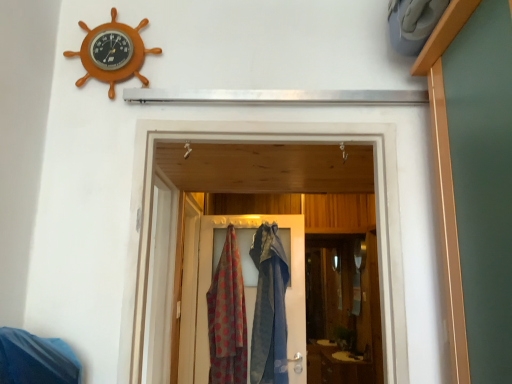
The height and width of the screenshot is (384, 512). I want to click on polka dot fabric scarf at center, so click(x=227, y=317).

Find the location of `orange wooden ship wheel at upper left`. orange wooden ship wheel at upper left is located at coordinates 112,53.

Is orange wooden ship wheel at upper left inside polka dot fabric scarf at center?

No.

From the image's perspective, is polka dot fabric scarf at center over orange wooden ship wheel at upper left?

No, from the image's perspective, polka dot fabric scarf at center is not on top of orange wooden ship wheel at upper left.

Which of these two, polka dot fabric scarf at center or orange wooden ship wheel at upper left, is bigger?

With larger size is polka dot fabric scarf at center.

Does textured fabric door at center have a smaller size compared to orange wooden ship wheel at upper left?

Actually, textured fabric door at center might be larger than orange wooden ship wheel at upper left.

What's the angular difference between textured fabric door at center and orange wooden ship wheel at upper left's facing directions?

8.61 degrees.

Looking at this image, from the image's perspective, is textured fabric door at center located above or below orange wooden ship wheel at upper left?

textured fabric door at center is below orange wooden ship wheel at upper left.

Based on the photo, can you confirm if textured fabric door at center is thinner than orange wooden ship wheel at upper left?

Incorrect, the width of textured fabric door at center is not less than that of orange wooden ship wheel at upper left.

In the scene shown: Can you confirm if polka dot fabric scarf at center is smaller than textured fabric door at center?

Yes, polka dot fabric scarf at center is smaller than textured fabric door at center.

At what (x,y) coordinates should I click in order to perform the action: click on clothing below the textured fabric door at center (from a real-world perspective). Please return your answer as a coordinate pair (x, y). This screenshot has height=384, width=512. Looking at the image, I should click on (227, 317).

Can we say polka dot fabric scarf at center lies outside textured fabric door at center?

Absolutely, polka dot fabric scarf at center is external to textured fabric door at center.

Can you tell me how much polka dot fabric scarf at center and textured fabric door at center differ in facing direction?

The angular difference between polka dot fabric scarf at center and textured fabric door at center is 3.8 degrees.

Between orange wooden ship wheel at upper left and polka dot fabric scarf at center, which one is positioned behind?

polka dot fabric scarf at center is further from the camera.

Consider the image. From the image's perspective, is orange wooden ship wheel at upper left positioned above or below polka dot fabric scarf at center?

Clearly, from the image's perspective, orange wooden ship wheel at upper left is above polka dot fabric scarf at center.

Is orange wooden ship wheel at upper left far away from polka dot fabric scarf at center?

Absolutely, orange wooden ship wheel at upper left is distant from polka dot fabric scarf at center.

Is orange wooden ship wheel at upper left completely or partially outside of polka dot fabric scarf at center?

Yes, orange wooden ship wheel at upper left is outside of polka dot fabric scarf at center.

Is textured fabric door at center further to the viewer compared to polka dot fabric scarf at center?

Yes, textured fabric door at center is further from the viewer.

From the image's perspective, is textured fabric door at center above polka dot fabric scarf at center?

Correct, textured fabric door at center appears higher than polka dot fabric scarf at center in the image.

Identify the location of door lying on the right of polka dot fabric scarf at center. (250, 279).

Is textured fabric door at center inside orange wooden ship wheel at upper left?

Actually, textured fabric door at center is outside orange wooden ship wheel at upper left.

From the image's perspective, which is above, orange wooden ship wheel at upper left or textured fabric door at center?

orange wooden ship wheel at upper left, from the image's perspective.

Can you tell me how much orange wooden ship wheel at upper left and textured fabric door at center differ in facing direction?

There is a 8.61-degree angle between the facing directions of orange wooden ship wheel at upper left and textured fabric door at center.

Does orange wooden ship wheel at upper left have a smaller size compared to textured fabric door at center?

Correct, orange wooden ship wheel at upper left occupies less space than textured fabric door at center.

The image size is (512, 384). Find the location of `clothing on the right side of orange wooden ship wheel at upper left`. clothing on the right side of orange wooden ship wheel at upper left is located at coordinates (227, 317).

In the image, there is a orange wooden ship wheel at upper left. Where is `door below it (from a real-world perspective)`? door below it (from a real-world perspective) is located at coordinates (250, 279).

Considering their positions, is textured fabric door at center positioned closer to orange wooden ship wheel at upper left than polka dot fabric scarf at center?

Among the two, polka dot fabric scarf at center is located nearer to orange wooden ship wheel at upper left.

Estimate the real-world distances between objects in this image. Which object is further from polka dot fabric scarf at center, orange wooden ship wheel at upper left or textured fabric door at center?

Based on the image, orange wooden ship wheel at upper left appears to be further to polka dot fabric scarf at center.

Based on their spatial positions, is polka dot fabric scarf at center or textured fabric door at center further from orange wooden ship wheel at upper left?

textured fabric door at center lies further to orange wooden ship wheel at upper left than the other object.

Looking at the image, which one is located closer to polka dot fabric scarf at center, textured fabric door at center or orange wooden ship wheel at upper left?

textured fabric door at center is positioned closer to the anchor polka dot fabric scarf at center.

Based on their spatial positions, is orange wooden ship wheel at upper left or polka dot fabric scarf at center further from textured fabric door at center?

Among the two, orange wooden ship wheel at upper left is located further to textured fabric door at center.

Which object lies nearer to the anchor point textured fabric door at center, polka dot fabric scarf at center or orange wooden ship wheel at upper left?

polka dot fabric scarf at center is positioned closer to the anchor textured fabric door at center.

At what (x,y) coordinates should I click in order to perform the action: click on clothing between orange wooden ship wheel at upper left and textured fabric door at center in the front-back direction. Please return your answer as a coordinate pair (x, y). The width and height of the screenshot is (512, 384). Looking at the image, I should click on (227, 317).